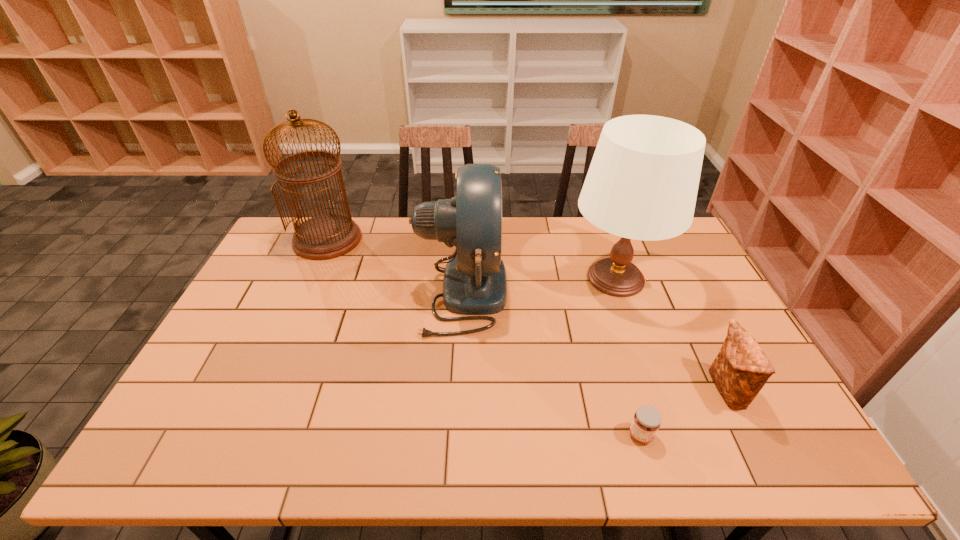
In order to click on free spot located in front of the fan to blow air in this screenshot , I will do `click(606, 292)`.

Where is `vacant region located 0.250m on the open side of the clutch bag`? vacant region located 0.250m on the open side of the clutch bag is located at coordinates (611, 390).

The image size is (960, 540). Identify the location of vacant point located on the open side of the clutch bag. (607, 390).

Locate an element on the screen. This screenshot has width=960, height=540. vacant space located on the open side of the clutch bag is located at coordinates click(618, 390).

Image resolution: width=960 pixels, height=540 pixels. In order to click on vacant space located 0.230m on the left of the shortest object in this screenshot , I will do `click(528, 435)`.

Locate an element on the screen. The height and width of the screenshot is (540, 960). lamp situated at the far edge is located at coordinates (642, 183).

The image size is (960, 540). I want to click on birdcage present at the far edge, so click(x=327, y=236).

Where is `fan present at the far edge`? The image size is (960, 540). fan present at the far edge is located at coordinates (474, 283).

Find the location of a particular element. The height and width of the screenshot is (540, 960). object present at the near edge is located at coordinates (647, 420).

Image resolution: width=960 pixels, height=540 pixels. Identify the location of object that is positioned at the left edge. (327, 236).